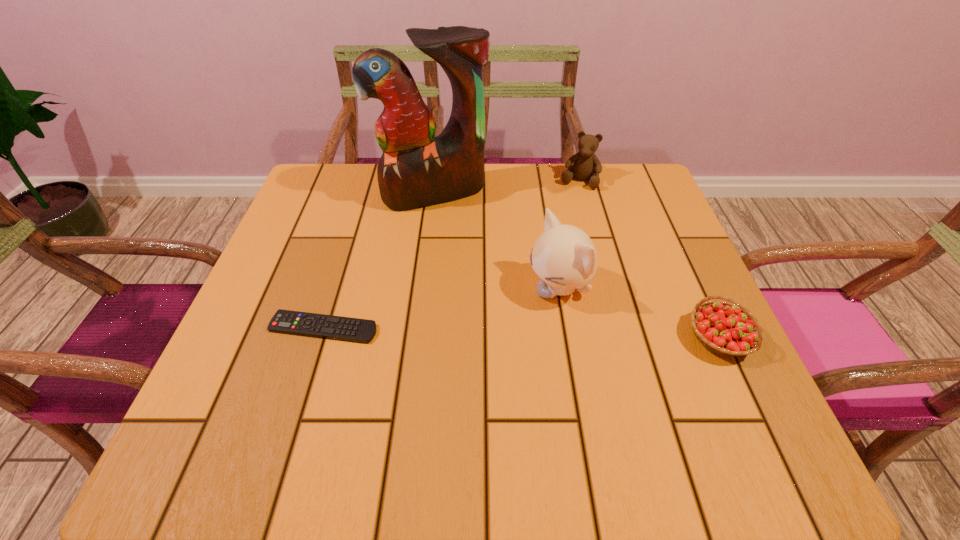
You are a GUI agent. You are given a task and a screenshot of the screen. Output one action in this format:
    pyautogui.click(x=<x>, y=<y>)
    Task: Click on the vacant area at the near right corner
    The width and height of the screenshot is (960, 540).
    Given the screenshot: What is the action you would take?
    pyautogui.click(x=667, y=395)

This screenshot has height=540, width=960. Identify the location of free spot between the remote control and the rightmost object. (521, 333).

Identify the location of free spot between the shortest object and the kitten. The height and width of the screenshot is (540, 960). (441, 308).

Where is `free spot between the strawberry and the teddy bear`? This screenshot has width=960, height=540. free spot between the strawberry and the teddy bear is located at coordinates (649, 259).

Locate an element on the screen. The width and height of the screenshot is (960, 540). free space that is in between the remote control and the second shortest object is located at coordinates (521, 333).

You are a GUI agent. You are given a task and a screenshot of the screen. Output one action in this format:
    pyautogui.click(x=<x>, y=<y>)
    Task: Click on the free space between the parrot and the third shortest object
    The height and width of the screenshot is (540, 960).
    Given the screenshot: What is the action you would take?
    pyautogui.click(x=506, y=187)

Where is `free area in between the teddy bear and the shortest object`? The height and width of the screenshot is (540, 960). free area in between the teddy bear and the shortest object is located at coordinates (451, 254).

Locate which object is the closest to the parrot. Please provide its 2D coordinates. Your answer should be formatted as a tuple, i.e. [(x, y)], where the tuple contains the x and y coordinates of a point satisfying the conditions above.

[(586, 165)]

In order to click on object that stands as the third closest to the parrot in this screenshot , I will do `click(339, 328)`.

What are the coordinates of `vacant space that satisfies the following two spatial constraints: 1. on the front side of the second tallest object; 2. on the right side of the tallest object` in the screenshot? It's located at (422, 288).